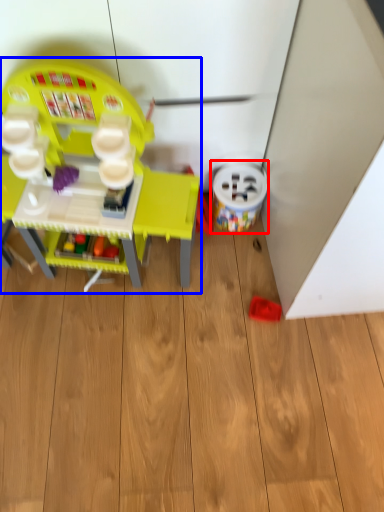
Question: Which of the following is the closest to the observer, toy (highlighted by a red box) or toy (highlighted by a blue box)?

Choices:
 (A) toy
 (B) toy

Answer: (B)